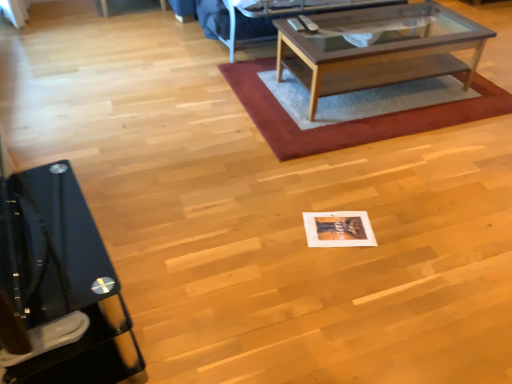
The image size is (512, 384). I want to click on black glossy desk at left, so click(62, 279).

From a real-world perspective, is wooden glass coffee table at center positioned above or below black glossy desk at left?

In terms of real-world spatial position, wooden glass coffee table at center is below black glossy desk at left.

Relative to black glossy desk at left, is wooden glass coffee table at center in front or behind?

wooden glass coffee table at center is positioned farther from the viewer than black glossy desk at left.

The width and height of the screenshot is (512, 384). I want to click on coffee table on the right of black glossy desk at left, so (378, 48).

Can you tell me how much rug with woven texture at center and black glossy desk at left differ in facing direction?

rug with woven texture at center and black glossy desk at left are facing 99.6 degrees away from each other.

Which of these two, rug with woven texture at center or black glossy desk at left, stands taller?

black glossy desk at left.

Does rug with woven texture at center have a smaller size compared to black glossy desk at left?

Actually, rug with woven texture at center might be larger than black glossy desk at left.

Can you confirm if rug with woven texture at center is wider than black glossy desk at left?

Yes.

Can you confirm if black glossy desk at left is thinner than wooden glass coffee table at center?

Yes.

Is black glossy desk at left not close to wooden glass coffee table at center?

That's right, there is a large distance between black glossy desk at left and wooden glass coffee table at center.

The image size is (512, 384). I want to click on coffee table lying above the black glossy desk at left (from the image's perspective), so click(378, 48).

How many degrees apart are the facing directions of black glossy desk at left and wooden glass coffee table at center?

99.2 degrees separate the facing orientations of black glossy desk at left and wooden glass coffee table at center.

Would you say rug with woven texture at center contains wooden glass coffee table at center?

Definitely not — wooden glass coffee table at center is not inside rug with woven texture at center.

From a real-world perspective, is rug with woven texture at center beneath wooden glass coffee table at center?

Indeed, from a real-world perspective, rug with woven texture at center is positioned beneath wooden glass coffee table at center.

Is rug with woven texture at center next to wooden glass coffee table at center and touching it?

rug with woven texture at center and wooden glass coffee table at center are not in contact.

Between black glossy desk at left and rug with woven texture at center, which one appears on the right side from the viewer's perspective?

rug with woven texture at center.

Does black glossy desk at left turn towards rug with woven texture at center?

Yes.

From the image's perspective, is black glossy desk at left below rug with woven texture at center?

Yes, from the image's perspective, black glossy desk at left is beneath rug with woven texture at center.

Between point (416, 66) and point (305, 155), which one is positioned behind?

The point (416, 66) is more distant.

Between wooden glass coffee table at center and rug with woven texture at center, which one has more height?

wooden glass coffee table at center.

You are a GUI agent. You are given a task and a screenshot of the screen. Output one action in this format:
    pyautogui.click(x=<x>, y=<y>)
    Task: Click on the coffee table above the rug with woven texture at center (from a real-world perspective)
    This screenshot has width=512, height=384.
    Given the screenshot: What is the action you would take?
    pyautogui.click(x=378, y=48)

Can you confirm if wooden glass coffee table at center is wider than rug with woven texture at center?

No.

The image size is (512, 384). What are the coordinates of `coffee table that is on the right side of black glossy desk at left` in the screenshot? It's located at (378, 48).

Identify the location of desk that appears in front of the rug with woven texture at center. Image resolution: width=512 pixels, height=384 pixels. (62, 279).

Considering their positions, is rug with woven texture at center positioned closer to wooden glass coffee table at center than black glossy desk at left?

rug with woven texture at center is closer to wooden glass coffee table at center.

Which object lies further to the anchor point black glossy desk at left, rug with woven texture at center or wooden glass coffee table at center?

wooden glass coffee table at center.

In the scene shown: Looking at the image, which one is located closer to wooden glass coffee table at center, black glossy desk at left or rug with woven texture at center?

The object closer to wooden glass coffee table at center is rug with woven texture at center.

From the image, which object appears to be farther from black glossy desk at left, wooden glass coffee table at center or rug with woven texture at center?

Based on the image, wooden glass coffee table at center appears to be further to black glossy desk at left.

When comparing their distances from rug with woven texture at center, does wooden glass coffee table at center or black glossy desk at left seem closer?

wooden glass coffee table at center is positioned closer to the anchor rug with woven texture at center.

Which object lies further to the anchor point rug with woven texture at center, black glossy desk at left or wooden glass coffee table at center?

black glossy desk at left.

What are the coordinates of `mat situated between black glossy desk at left and wooden glass coffee table at center from left to right` in the screenshot? It's located at (353, 120).